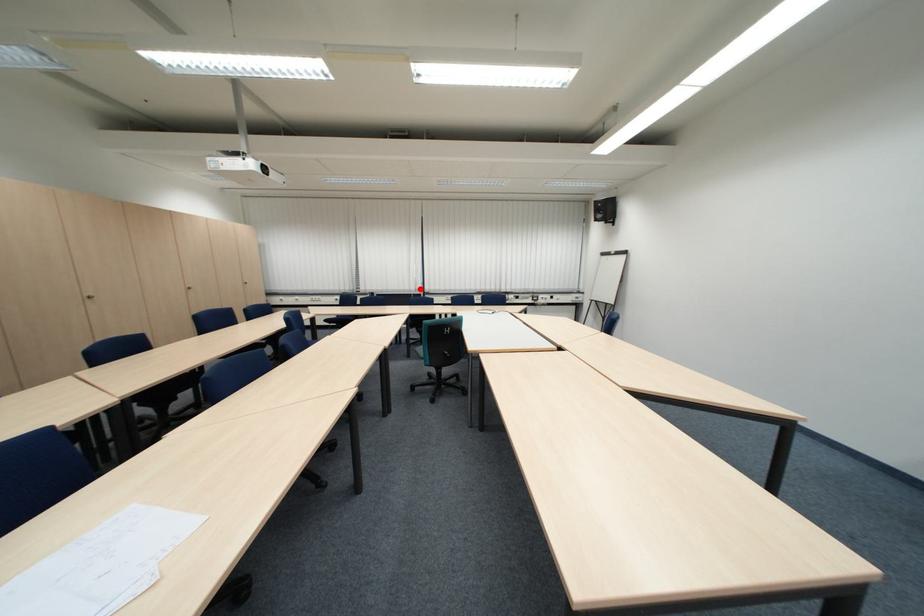
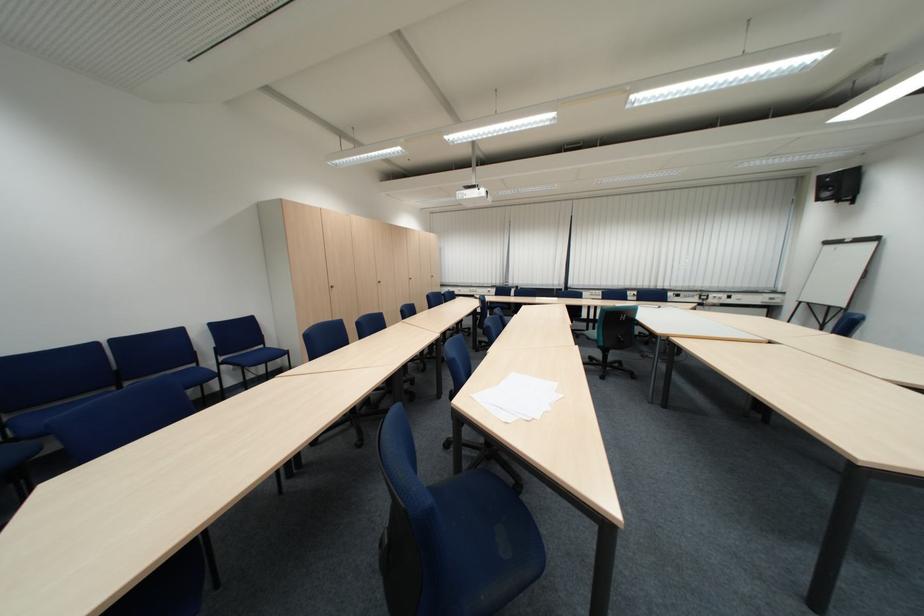
Question: I am providing you with two images of the same scene from different viewpoints. Image1 has a red point marked. In image2, the corresponding 3D location appears at what relative position? Reply with the corresponding letter.

Choices:
 (A) Closer
 (B) Farther

Answer: (B)